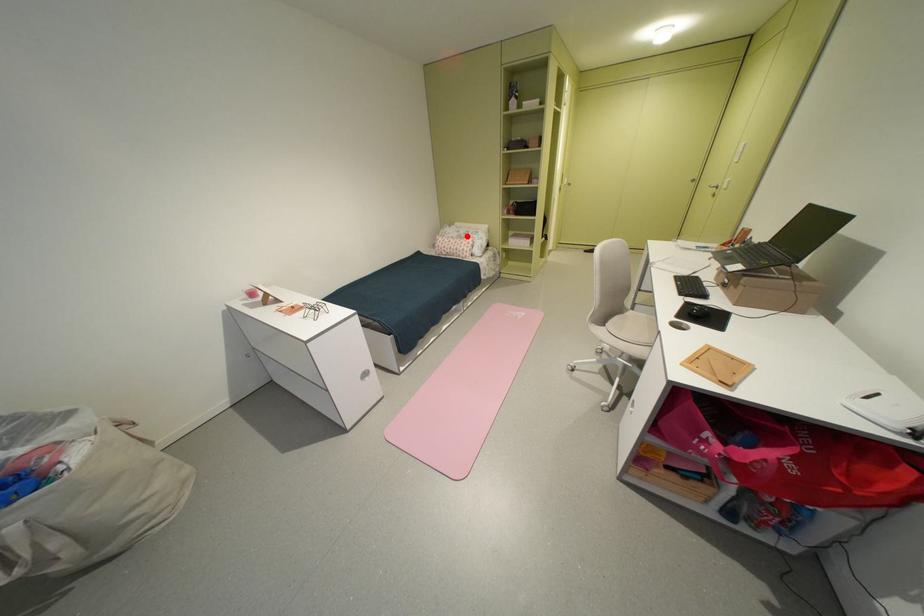
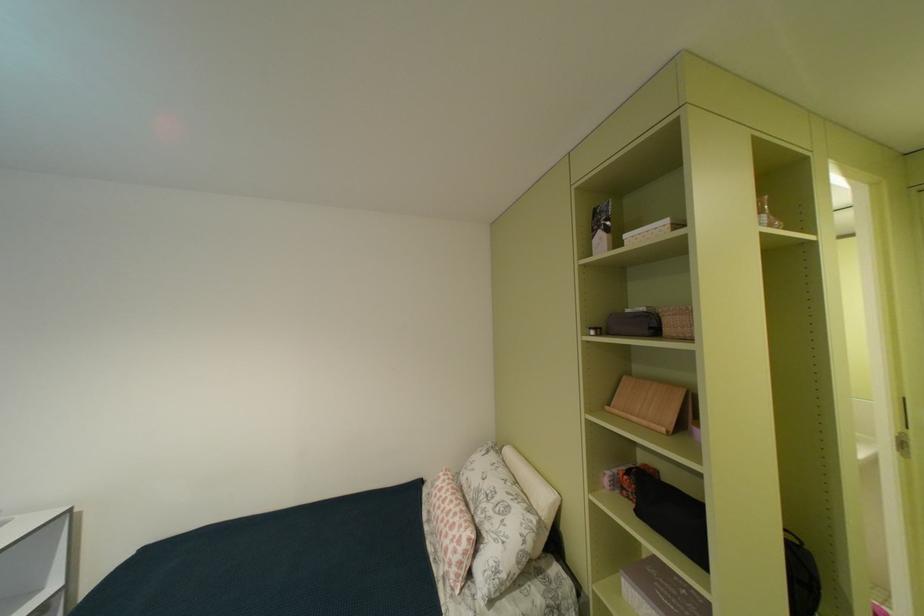
Question: I am providing you with two images of the same scene from different viewpoints. Image1 has a red point marked. In image2, the corresponding 3D location appears at what relative position? Reply with the corresponding letter.

Choices:
 (A) Closer
 (B) Farther

Answer: (B)